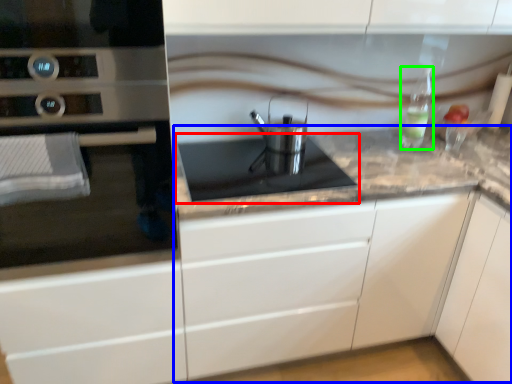
Question: Based on their relative distances, which object is farther from gas stove (highlighted by a red box)? Choose from counter (highlighted by a blue box) and bottle (highlighted by a green box).

Choices:
 (A) counter
 (B) bottle

Answer: (B)